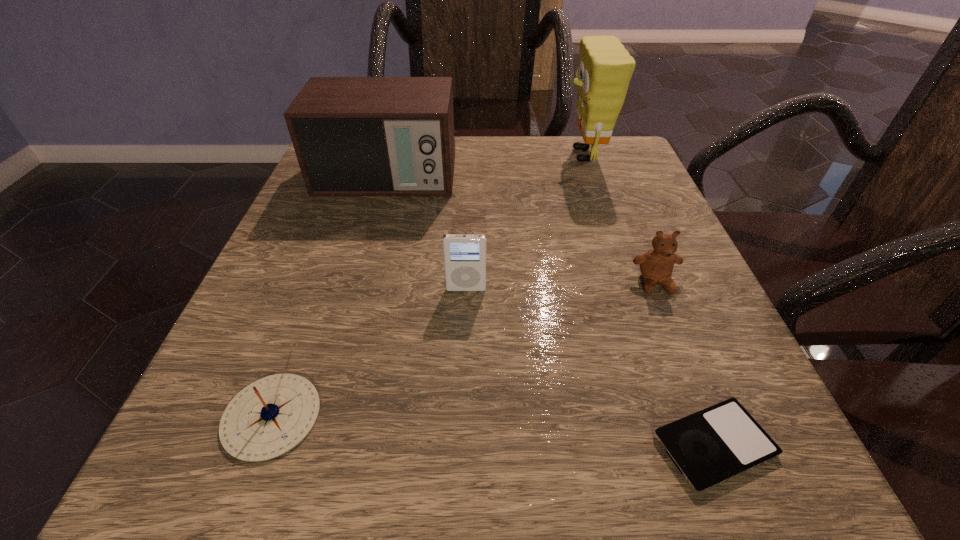
In the image, there is a desktop. Where is `vacant space at the left edge`? The height and width of the screenshot is (540, 960). vacant space at the left edge is located at coordinates (288, 271).

Locate an element on the screen. vacant area at the right edge of the desktop is located at coordinates (634, 294).

This screenshot has width=960, height=540. In the image, there is a desktop. Find the location of `vacant space at the near left corner`. vacant space at the near left corner is located at coordinates (174, 460).

In the image, there is a desktop. In order to click on free space at the far right corner in this screenshot , I will do `click(571, 151)`.

Locate an element on the screen. free area in between the fifth tallest object and the tallest object is located at coordinates (428, 286).

Where is `free space between the fifth shortest object and the sponge`? free space between the fifth shortest object and the sponge is located at coordinates (485, 166).

At what (x,y) coordinates should I click in order to perform the action: click on free spot between the second tallest object and the tallest object. Please return your answer as a coordinate pair (x, y). The width and height of the screenshot is (960, 540). Looking at the image, I should click on (485, 166).

What are the coordinates of `vacant point located between the left iPod and the compass` in the screenshot? It's located at (369, 353).

Identify the location of vacant region between the right iPod and the tallest object. The width and height of the screenshot is (960, 540). (649, 300).

You are a GUI agent. You are given a task and a screenshot of the screen. Output one action in this format:
    pyautogui.click(x=<x>, y=<y>)
    Task: Click on the free space between the third object from left to right and the tallest object
    
    Given the screenshot: What is the action you would take?
    pyautogui.click(x=525, y=222)